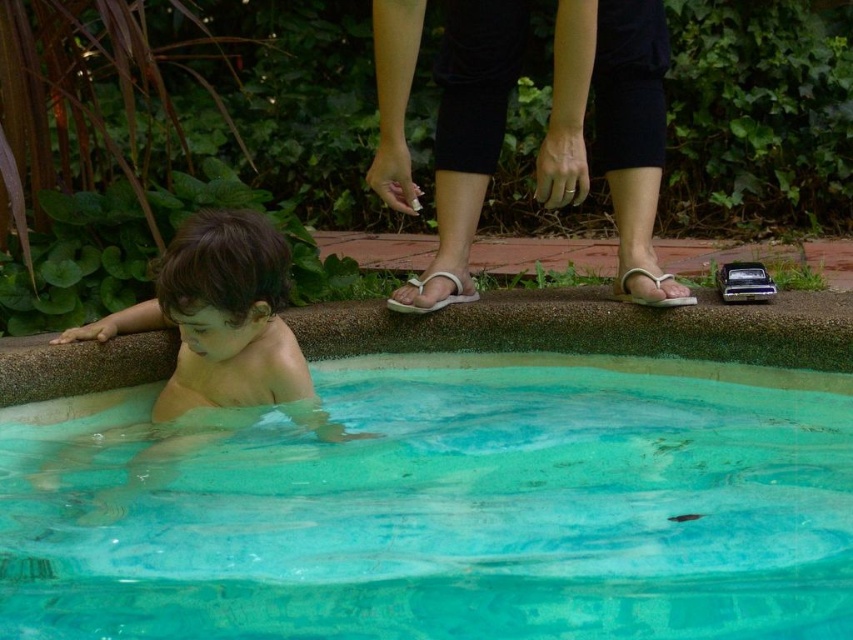
You are standing at the point with coordinates point (468, 90) and want to walk to the point with coordinates point (846, 493). Which direction should you move to reach your destination?

To move from point (468, 90) to point (846, 493), you should move forward since point (846, 493) is in front of point (468, 90).

You are a drone operator trying to capture a photo of the pool area. The clear plastic water at lower center is where you want to focus. Using the coordinates provided, can you confirm if the point at (457, 509) is the correct location for the center of your photo?

Yes, the clear plastic water at lower center is represented by the point at (457, 509), so this is the correct location for the center of your photo.

You are a shoe salesperson and need to determine which sandal takes up more space horizontally between the white leather sandals at center and the white fabric sandal at center. Which one is wider?

The white leather sandals at center are wider than the white fabric sandal at center since their width surpasses the latter.